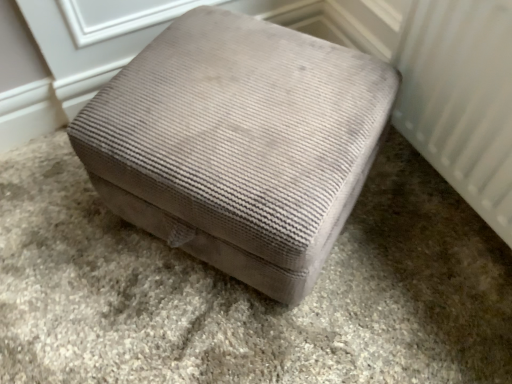
Question: From their relative heights in the image, would you say white textured radiator at right is taller or shorter than velvet ottoman at center?

Choices:
 (A) short
 (B) tall

Answer: (B)

Question: Looking at their shapes, would you say white textured radiator at right is wider or thinner than velvet ottoman at center?

Choices:
 (A) thin
 (B) wide

Answer: (A)

Question: Which object is positioned closest to the beige textured ottoman at center?

Choices:
 (A) velvet ottoman at center
 (B) velvet ottoman at center
 (C) white textured radiator at right

Answer: (B)

Question: Which is farther from the beige textured ottoman at center?

Choices:
 (A) white textured radiator at right
 (B) velvet ottoman at center
 (C) velvet ottoman at center

Answer: (A)